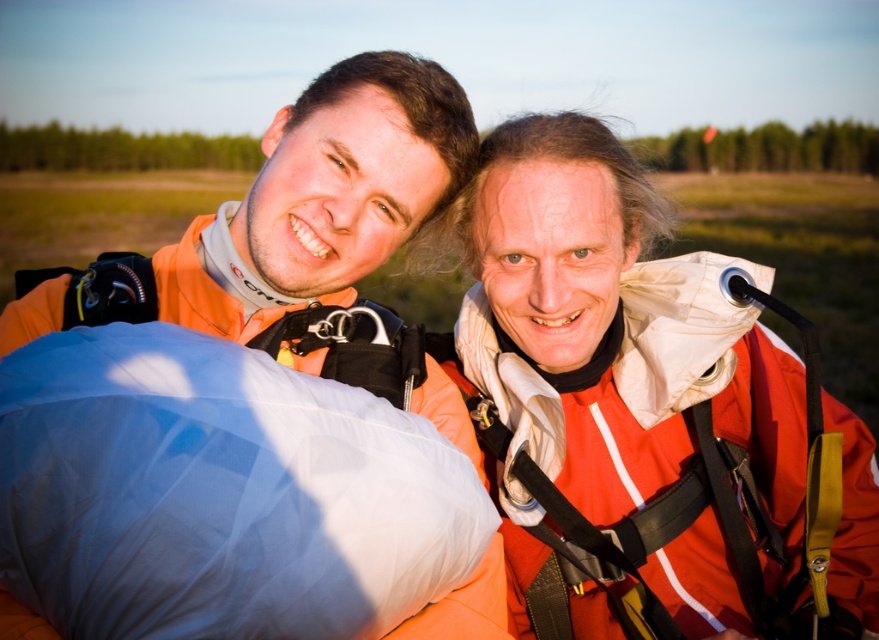
Question: Where is matte orange jumpsuit at center located in relation to blue fabric sleeping bag at lower left in the image?

Choices:
 (A) below
 (B) above

Answer: (B)

Question: Does matte orange jumpsuit at center appear under blue fabric sleeping bag at lower left?

Choices:
 (A) yes
 (B) no

Answer: (B)

Question: Which object appears closest to the camera in this image?

Choices:
 (A) blue fabric sleeping bag at lower left
 (B) matte orange jumpsuit at center

Answer: (A)

Question: Which point appears closest to the camera in this image?

Choices:
 (A) (262, 362)
 (B) (774, 445)

Answer: (A)

Question: Can you confirm if matte orange jumpsuit at center is bigger than blue fabric sleeping bag at lower left?

Choices:
 (A) yes
 (B) no

Answer: (A)

Question: Which point is closer to the camera?

Choices:
 (A) matte orange jumpsuit at center
 (B) blue fabric sleeping bag at lower left

Answer: (B)